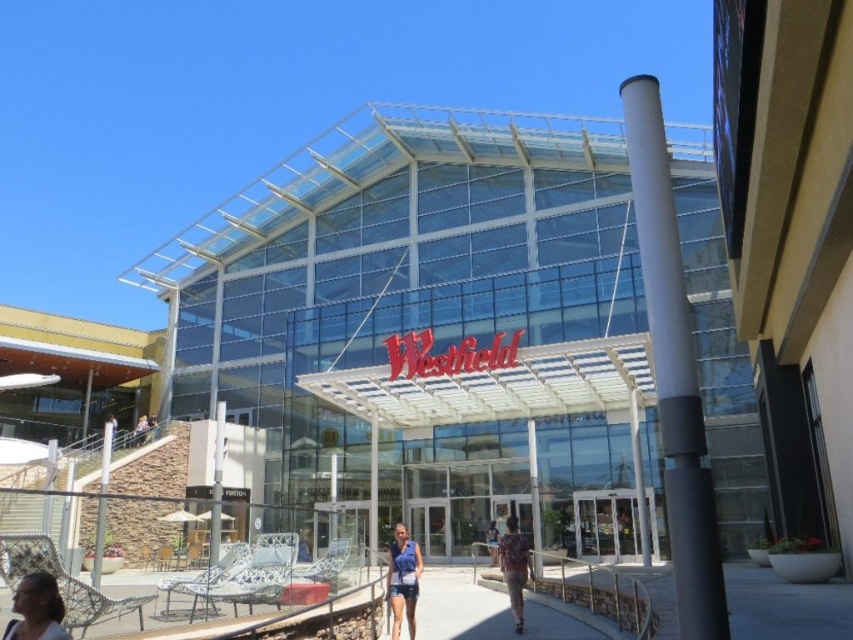
Question: Where is matte blue shorts at center located in relation to blue denim shorts at center in the image?

Choices:
 (A) right
 (B) left

Answer: (A)

Question: Is matte blue shorts at center positioned at the back of blue denim shorts at center?

Choices:
 (A) no
 (B) yes

Answer: (B)

Question: Which object is the farthest from the blue denim shorts at center?

Choices:
 (A) matte black hair at lower left
 (B) matte blue shorts at center

Answer: (A)

Question: Which point is closer to the camera taking this photo?

Choices:
 (A) (521, 588)
 (B) (28, 621)
 (C) (508, 602)

Answer: (B)

Question: Observing the image, what is the correct spatial positioning of matte black hair at lower left in reference to floral fabric shirt at lower center?

Choices:
 (A) above
 (B) below

Answer: (A)

Question: Which object appears farthest from the camera in this image?

Choices:
 (A) blue denim shorts at center
 (B) matte blue shorts at center
 (C) floral fabric shirt at lower center

Answer: (C)